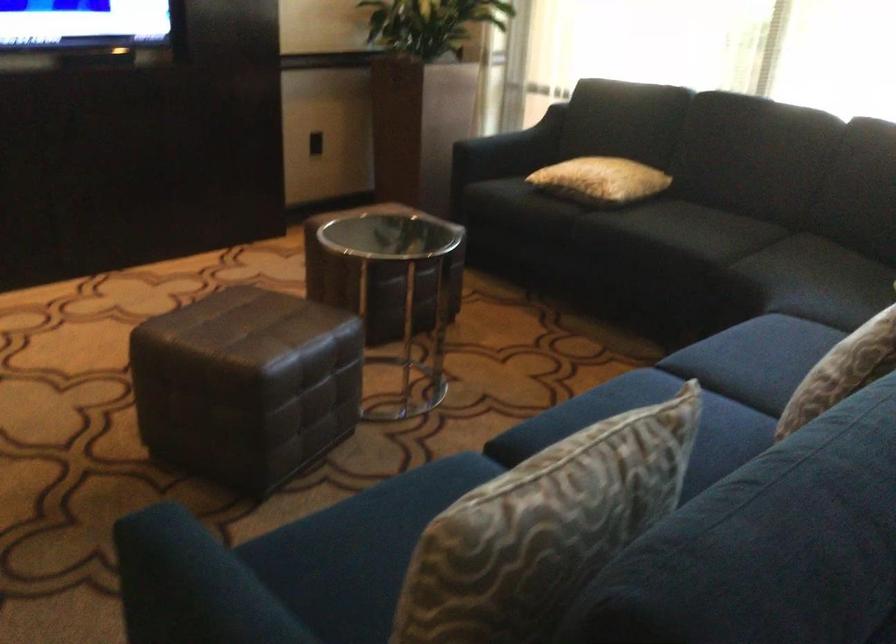
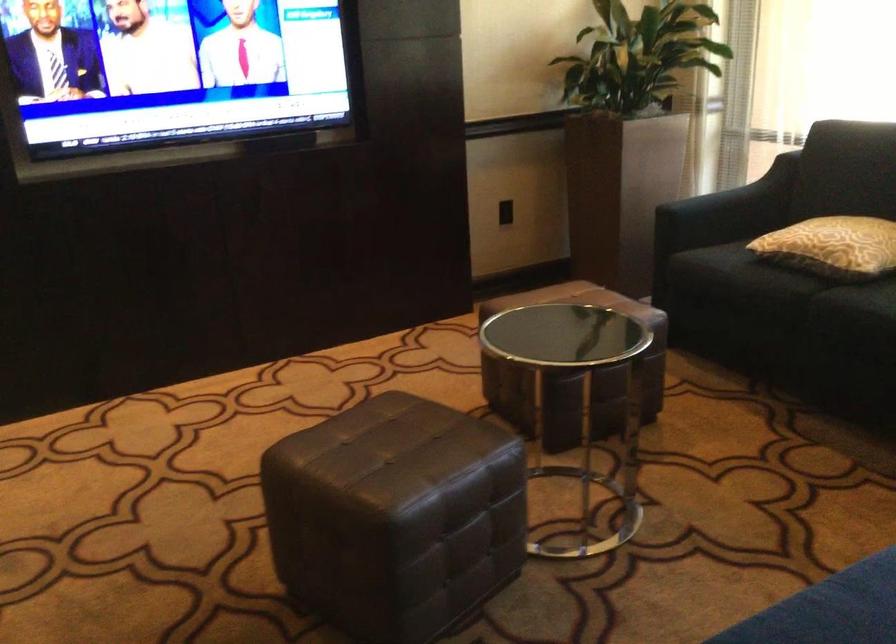
In the second image, find the point that corresponds to point (521, 140) in the first image.

(742, 196)